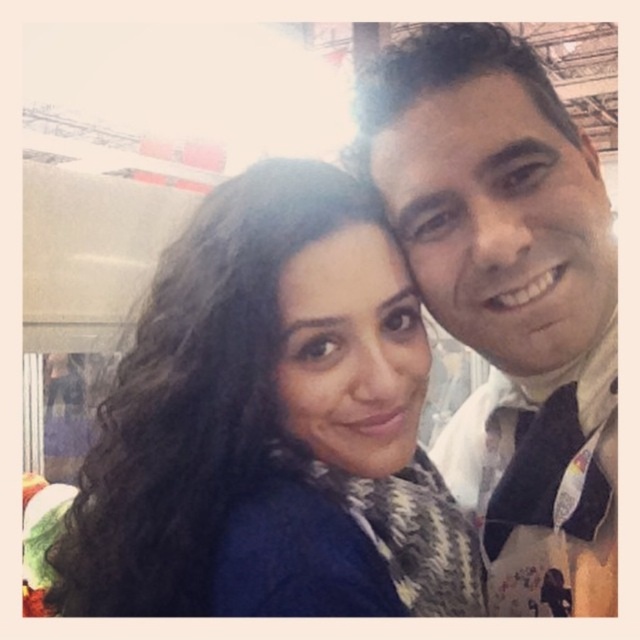
You are trying to decide which item to grab quickly from the center of the image. The dark blue sweater at center and the white textured scarf at right are both within reach. Based on their sizes, which one is more likely to be easier to grab?

The dark blue sweater at center is wider than the white textured scarf at right, so it might be easier to grab because of its larger size.

You are taking a selfie with two people. You want to ensure that both individuals are in focus. The camera you are using has a depth of field that can sharply focus on objects within 24 inches from the camera. Is the point at coordinates point (106, 573) within the depth of field range?

The point at coordinates point (106, 573) is 24.17 inches from the camera, which is slightly beyond the 24 inches depth of field range. Therefore, it may not be in sharp focus.